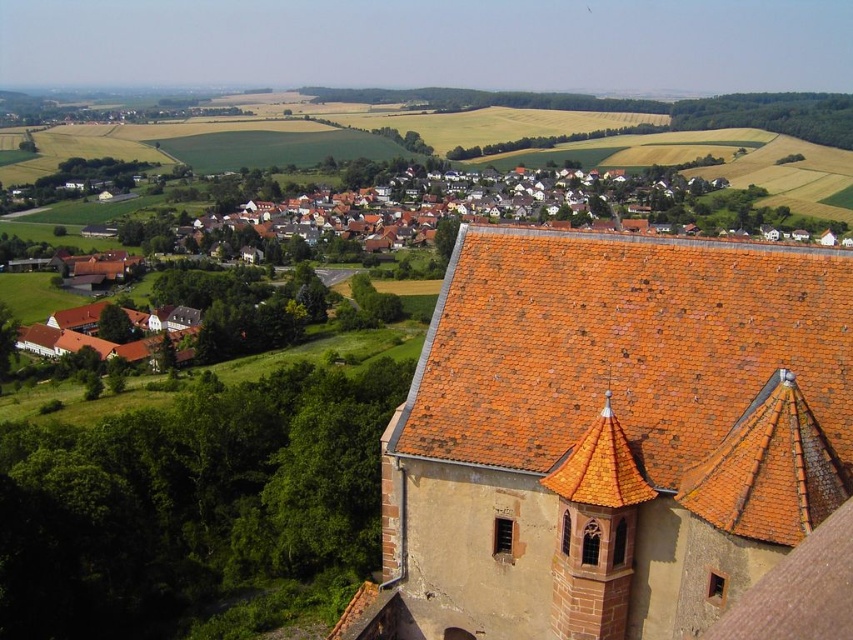
Is point (838, 436) positioned after point (608, 424)?

No, it is not.

Which is behind, point (469, 326) or point (587, 616)?

The point (469, 326) is more distant.

The image size is (853, 640). I want to click on orange clay tiles at upper right, so click(x=622, y=346).